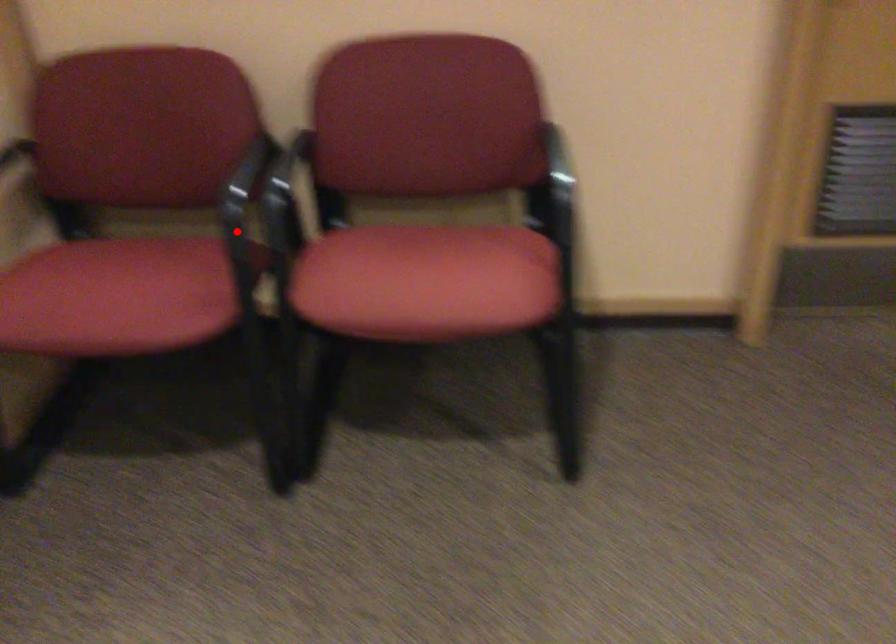
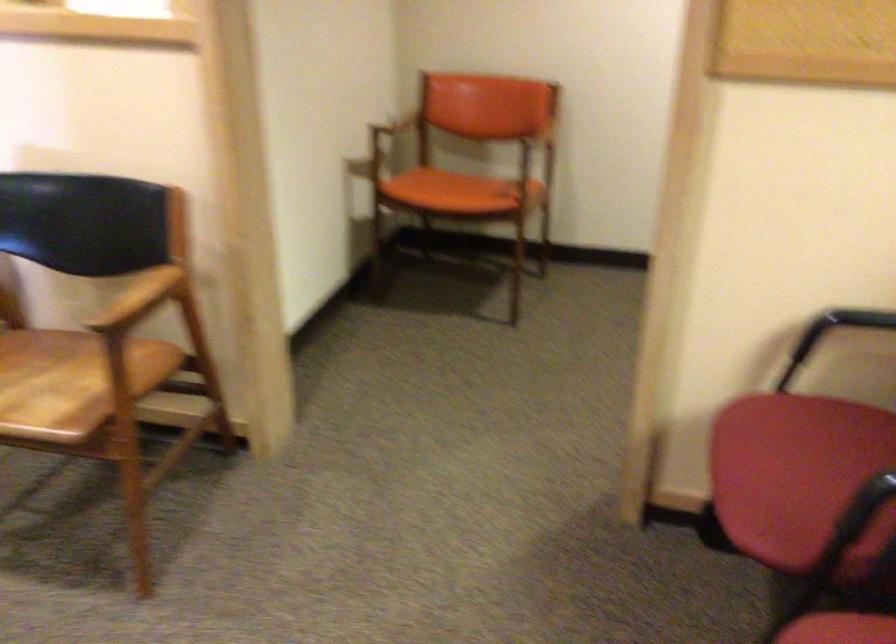
In the second image, find the point that corresponds to the highlighted location in the first image.

(865, 506)